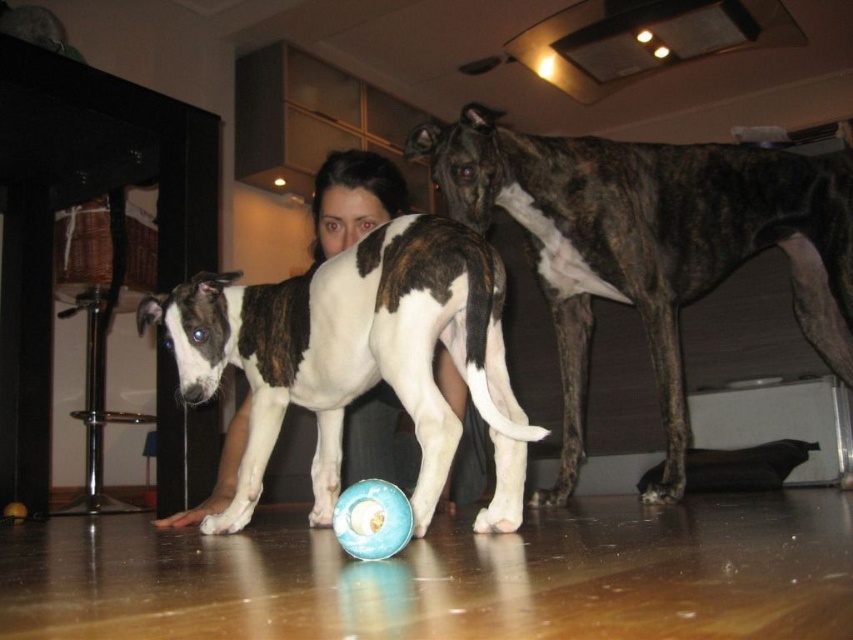
You are standing in the kitchen and see two points marked in the image. The first point is at coordinates point (531, 177) and the second is at point (335, 538). Which point is closer to you?

Point (531, 177) is closer to you because it is further to the viewer than point (335, 538).

You are standing in the kitchen and want to place a small plant between the two points marked as point (x=462, y=227) and point (x=376, y=518). Which point should the plant be closer to so that it appears centered from your viewpoint?

The plant should be placed closer to point (x=376, y=518) because point (x=462, y=227) is further away from the camera. To appear centered from your viewpoint, the plant needs to be positioned closer to the nearer point to balance the distance visually.

You are a dog trainer observing the two dogs in the kitchen. Which dog, the brindle fur dog at center or the brown and white fur at center, would you expect to have a bigger appetite based on their size?

The brindle fur dog at center is larger in size compared to the brown and white fur at center, so it would likely have a bigger appetite.